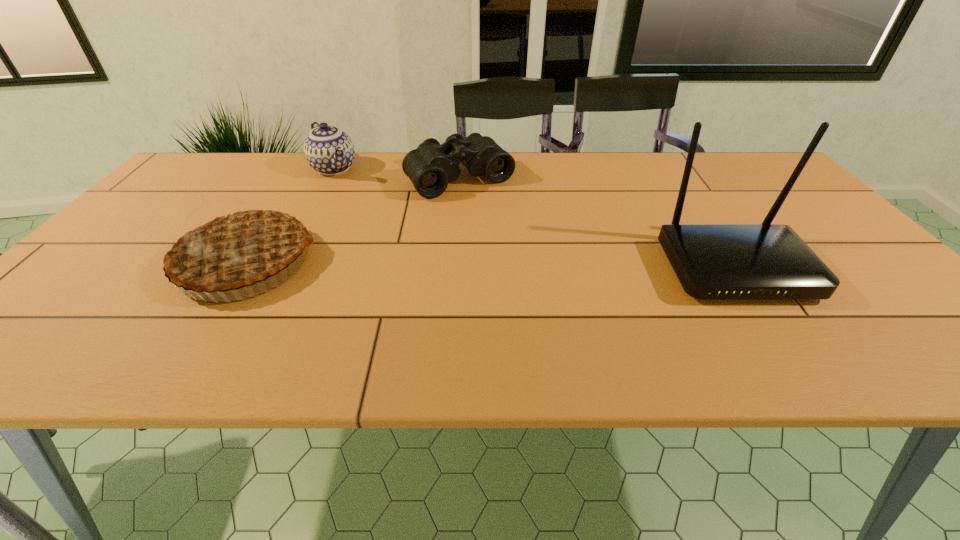
This screenshot has width=960, height=540. Find the location of `vacant spot on the desktop that is between the pie and the tallest object and is positioned at the eyepieces of the second object from right to left`. vacant spot on the desktop that is between the pie and the tallest object and is positioned at the eyepieces of the second object from right to left is located at coordinates (535, 266).

Image resolution: width=960 pixels, height=540 pixels. In order to click on vacant space on the desktop that is between the third shortest object and the rightmost object and is positioned at the spout of the chinaware in this screenshot , I will do `click(426, 265)`.